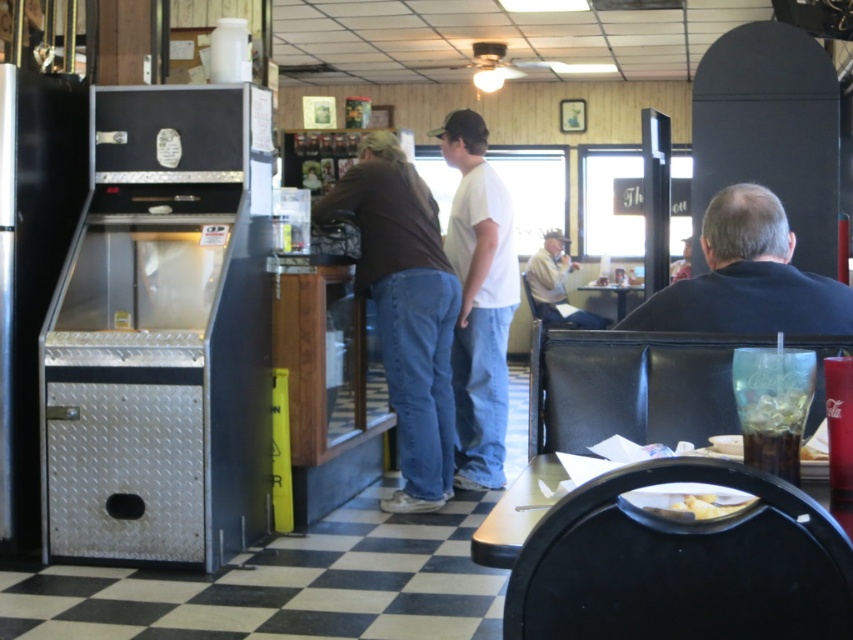
Question: Which object is closer to the camera taking this photo?

Choices:
 (A) brown cotton shirt at center
 (B) white matte shirt at center

Answer: (A)

Question: Does white matte shirt at center lie behind gray fabric shirt at center?

Choices:
 (A) yes
 (B) no

Answer: (B)

Question: In this image, where is white matte shirt at center located relative to dark blue shirt at right?

Choices:
 (A) above
 (B) below

Answer: (B)

Question: Is brown cotton shirt at center positioned at the back of translucent plastic cup at lower right?

Choices:
 (A) no
 (B) yes

Answer: (B)

Question: Which of the following is the closest to the observer?

Choices:
 (A) brown cotton shirt at center
 (B) translucent plastic cup at lower right

Answer: (B)

Question: Which is nearer to the brown cotton shirt at center?

Choices:
 (A) white matte shirt at center
 (B) dark blue shirt at right

Answer: (A)